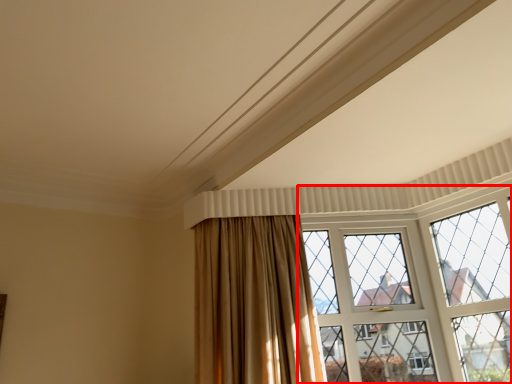
Question: From the image's perspective, considering the relative positions of window (annotated by the red box) and curtain in the image provided, where is window (annotated by the red box) located with respect to the staircase?

Choices:
 (A) above
 (B) below

Answer: (B)